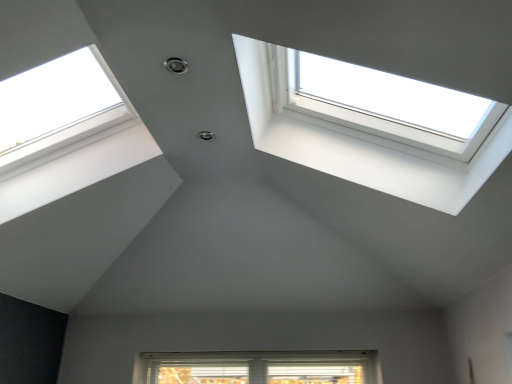
Question: Is white plastic window at upper right, positioned as the second window in left-to-right order, to the left or to the right of white plastic window at upper left, the 2th window when ordered from right to left, in the image?

Choices:
 (A) right
 (B) left

Answer: (A)

Question: Considering their positions, is white plastic window at upper right, which is the 1th window from right to left, located in front of or behind white plastic window at upper left, the 2th window when ordered from right to left?

Choices:
 (A) front
 (B) behind

Answer: (A)

Question: Is white plastic window at upper right, positioned as the second window in left-to-right order, bigger or smaller than white plastic window at upper left, which is counted as the 1th window, starting from the left?

Choices:
 (A) small
 (B) big

Answer: (B)

Question: From the image's perspective, is white plastic window at upper left, the 2th window when ordered from right to left, located above or below white plastic window at upper right, which is the 1th window from right to left?

Choices:
 (A) above
 (B) below

Answer: (B)

Question: From their relative heights in the image, would you say white plastic window at upper left, which is counted as the 1th window, starting from the left, is taller or shorter than white plastic window at upper right, positioned as the second window in left-to-right order?

Choices:
 (A) tall
 (B) short

Answer: (A)

Question: In terms of width, does white plastic window at upper left, the 2th window when ordered from right to left, look wider or thinner when compared to white plastic window at upper right, which is the 1th window from right to left?

Choices:
 (A) thin
 (B) wide

Answer: (A)

Question: From a real-world perspective, relative to white plastic window at upper right, positioned as the second window in left-to-right order, is white plastic window at upper left, the 2th window when ordered from right to left, vertically above or below?

Choices:
 (A) below
 (B) above

Answer: (A)